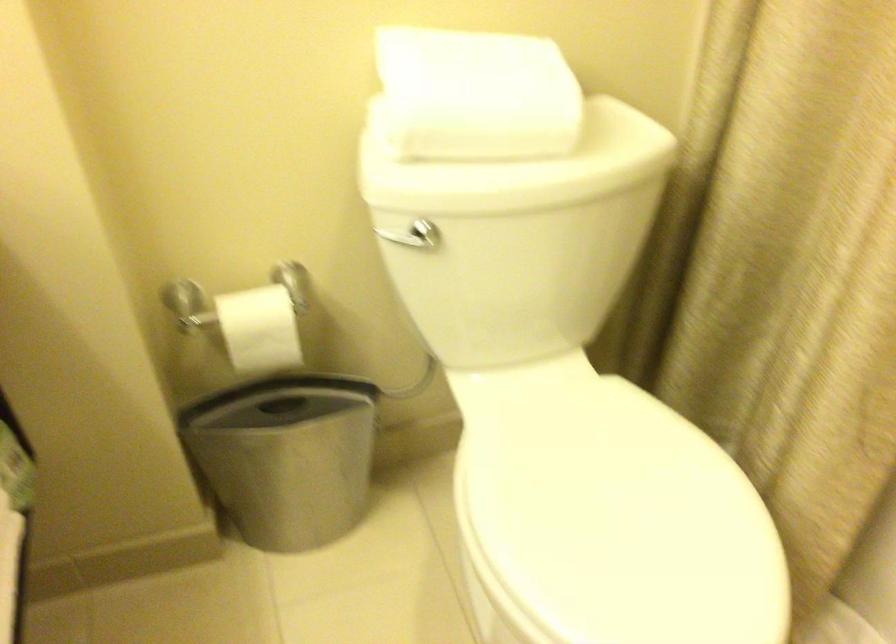
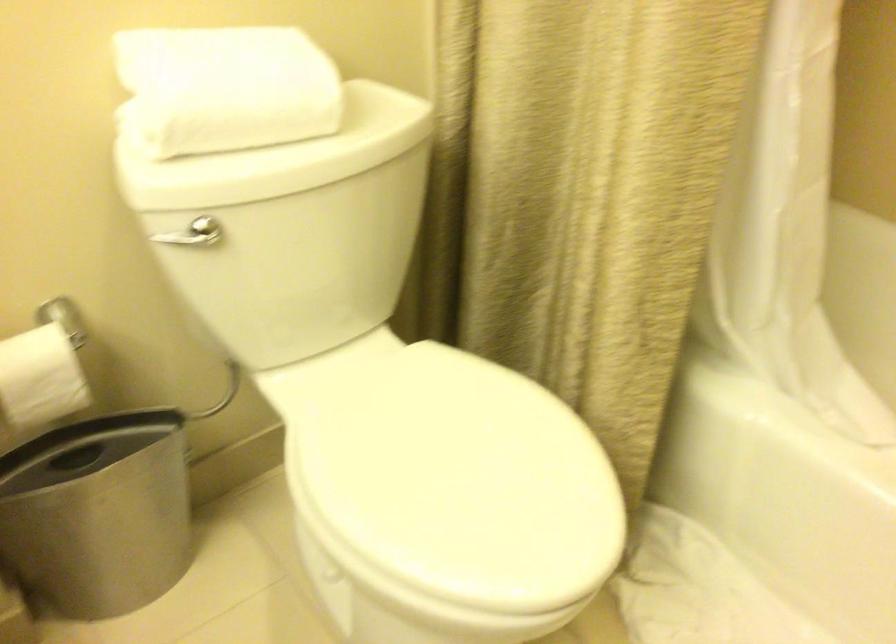
The point at (467,102) is marked in the first image. Where is the corresponding point in the second image?

(225, 88)